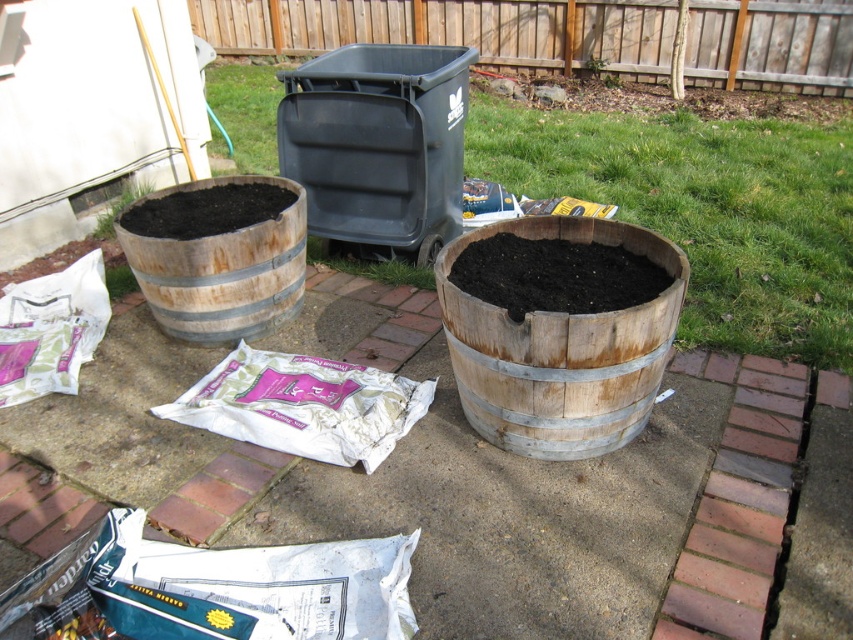
Does brown wooden barrel at center have a greater height compared to green matte plant at left?

Yes.

Who is more forward, (357,269) or (114,300)?

Point (114,300)

The image size is (853, 640). I want to click on brown wooden barrel at center, so click(x=369, y=266).

Is wooden barrel at left to the left of brown wooden barrel at center from the viewer's perspective?

Correct, you'll find wooden barrel at left to the left of brown wooden barrel at center.

Is point (251, 332) closer to camera compared to point (306, 248)?

That is True.

The height and width of the screenshot is (640, 853). Find the location of `wooden barrel at left`. wooden barrel at left is located at coordinates (218, 256).

In the scene shown: Which is more to the left, brown wooden barrel at center or green leafy plant at upper center?

brown wooden barrel at center is more to the left.

Does brown wooden barrel at center lie in front of green leafy plant at upper center?

That is True.

Who is more distant from viewer, (397, 266) or (595, 74)?

The point (595, 74) is behind.

Where is `brown wooden barrel at center`? brown wooden barrel at center is located at coordinates (369, 266).